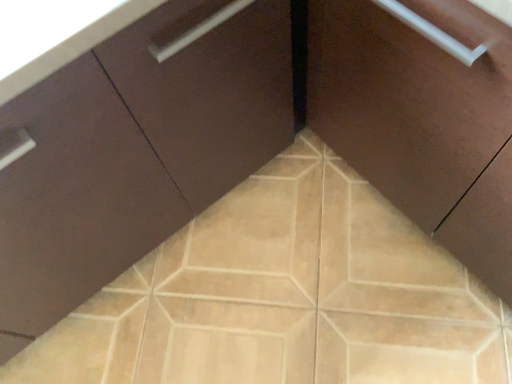
Find the location of a particular element. The image size is (512, 384). matte brown cabinet at center, which appears as the 1th cabinetry when viewed from the left is located at coordinates (134, 150).

Find the location of a particular element. This screenshot has height=384, width=512. matte brown cabinet at center, which is the second cabinetry from left to right is located at coordinates (422, 120).

At what (x,y) coordinates should I click in order to perform the action: click on beige ceramic tile at center. Please return your answer as a coordinate pair (x, y). Looking at the image, I should click on (285, 296).

From the image's perspective, is matte brown cabinet at center, which is the second cabinetry from left to right, below beige ceramic tile at center?

No, from the image's perspective, matte brown cabinet at center, which is the second cabinetry from left to right, is not beneath beige ceramic tile at center.

Considering the positions of objects matte brown cabinet at center, arranged as the 1th cabinetry when viewed from the right, and beige ceramic tile at center in the image provided, who is more to the right, matte brown cabinet at center, arranged as the 1th cabinetry when viewed from the right, or beige ceramic tile at center?

Positioned to the right is matte brown cabinet at center, arranged as the 1th cabinetry when viewed from the right.

Considering the sizes of matte brown cabinet at center, which is the second cabinetry from left to right, and beige ceramic tile at center in the image, is matte brown cabinet at center, which is the second cabinetry from left to right, taller or shorter than beige ceramic tile at center?

Clearly, matte brown cabinet at center, which is the second cabinetry from left to right, is taller compared to beige ceramic tile at center.

Is matte brown cabinet at center, arranged as the 1th cabinetry when viewed from the right, touching beige ceramic tile at center?

No, matte brown cabinet at center, arranged as the 1th cabinetry when viewed from the right, is not making contact with beige ceramic tile at center.

Is matte brown cabinet at center, arranged as the 1th cabinetry when viewed from the right, next to matte brown cabinet at center, the 2th cabinetry viewed from the right?

matte brown cabinet at center, arranged as the 1th cabinetry when viewed from the right, is not next to matte brown cabinet at center, the 2th cabinetry viewed from the right, and they're not touching.

Does matte brown cabinet at center, which is the second cabinetry from left to right, come in front of matte brown cabinet at center, the 2th cabinetry viewed from the right?

No.

From the image's perspective, which is above, matte brown cabinet at center, arranged as the 1th cabinetry when viewed from the right, or matte brown cabinet at center, which appears as the 1th cabinetry when viewed from the left?

matte brown cabinet at center, arranged as the 1th cabinetry when viewed from the right.

Is matte brown cabinet at center, which is the second cabinetry from left to right, at the right side of matte brown cabinet at center, the 2th cabinetry viewed from the right?

Yes.

From the image's perspective, between beige ceramic tile at center and matte brown cabinet at center, which is the second cabinetry from left to right, who is located below?

beige ceramic tile at center, from the image's perspective.

Which object is thinner, beige ceramic tile at center or matte brown cabinet at center, arranged as the 1th cabinetry when viewed from the right?

With smaller width is matte brown cabinet at center, arranged as the 1th cabinetry when viewed from the right.

How different are the orientations of beige ceramic tile at center and matte brown cabinet at center, arranged as the 1th cabinetry when viewed from the right, in degrees?

They differ by 0.269 degrees in their facing directions.

Considering the points (145, 331) and (329, 67), which point is in front, point (145, 331) or point (329, 67)?

The point (329, 67) is closer.

Is point (280, 108) in front of point (359, 13)?

No, (280, 108) is further to viewer.

Considering the sizes of objects matte brown cabinet at center, the 2th cabinetry viewed from the right, and matte brown cabinet at center, arranged as the 1th cabinetry when viewed from the right, in the image provided, who is smaller, matte brown cabinet at center, the 2th cabinetry viewed from the right, or matte brown cabinet at center, arranged as the 1th cabinetry when viewed from the right,?

Smaller between the two is matte brown cabinet at center, arranged as the 1th cabinetry when viewed from the right.

Measure the distance from matte brown cabinet at center, which appears as the 1th cabinetry when viewed from the left, to matte brown cabinet at center, which is the second cabinetry from left to right.

They are 17.14 inches apart.

Between matte brown cabinet at center, which appears as the 1th cabinetry when viewed from the left, and matte brown cabinet at center, which is the second cabinetry from left to right, which one appears on the left side from the viewer's perspective?

From the viewer's perspective, matte brown cabinet at center, which appears as the 1th cabinetry when viewed from the left, appears more on the left side.

Is beige ceramic tile at center taller than matte brown cabinet at center, which appears as the 1th cabinetry when viewed from the left?

Incorrect, the height of beige ceramic tile at center is not larger of that of matte brown cabinet at center, which appears as the 1th cabinetry when viewed from the left.

Can you tell me how much beige ceramic tile at center and matte brown cabinet at center, which appears as the 1th cabinetry when viewed from the left, differ in facing direction?

beige ceramic tile at center and matte brown cabinet at center, which appears as the 1th cabinetry when viewed from the left, are facing 90.3 degrees away from each other.

Considering the sizes of objects beige ceramic tile at center and matte brown cabinet at center, the 2th cabinetry viewed from the right, in the image provided, who is wider, beige ceramic tile at center or matte brown cabinet at center, the 2th cabinetry viewed from the right,?

beige ceramic tile at center.

Does matte brown cabinet at center, which appears as the 1th cabinetry when viewed from the left, have a lesser height compared to beige ceramic tile at center?

No.

Is matte brown cabinet at center, which appears as the 1th cabinetry when viewed from the left, beside beige ceramic tile at center?

No, matte brown cabinet at center, which appears as the 1th cabinetry when viewed from the left, is not in contact with beige ceramic tile at center.

Is matte brown cabinet at center, which appears as the 1th cabinetry when viewed from the left, positioned beyond the bounds of beige ceramic tile at center?

Yes.

There is a beige ceramic tile at center. At what (x,y) coordinates should I click in order to perform the action: click on the 1st cabinetry above it (from a real-world perspective). Please return your answer as a coordinate pair (x, y). Looking at the image, I should click on (422, 120).

The width and height of the screenshot is (512, 384). Find the location of `cabinetry behind the matte brown cabinet at center, the 2th cabinetry viewed from the right`. cabinetry behind the matte brown cabinet at center, the 2th cabinetry viewed from the right is located at coordinates (422, 120).

Based on their spatial positions, is matte brown cabinet at center, which appears as the 1th cabinetry when viewed from the left, or matte brown cabinet at center, arranged as the 1th cabinetry when viewed from the right, closer to beige ceramic tile at center?

Based on the image, matte brown cabinet at center, which appears as the 1th cabinetry when viewed from the left, appears to be nearer to beige ceramic tile at center.

Looking at this image, which object lies further to the anchor point matte brown cabinet at center, which appears as the 1th cabinetry when viewed from the left, matte brown cabinet at center, arranged as the 1th cabinetry when viewed from the right, or beige ceramic tile at center?

matte brown cabinet at center, arranged as the 1th cabinetry when viewed from the right, is further to matte brown cabinet at center, which appears as the 1th cabinetry when viewed from the left.

From the image, which object appears to be nearer to matte brown cabinet at center, the 2th cabinetry viewed from the right, beige ceramic tile at center or matte brown cabinet at center, which is the second cabinetry from left to right?

The object closer to matte brown cabinet at center, the 2th cabinetry viewed from the right, is beige ceramic tile at center.

Based on their spatial positions, is matte brown cabinet at center, arranged as the 1th cabinetry when viewed from the right, or matte brown cabinet at center, the 2th cabinetry viewed from the right, closer to beige ceramic tile at center?

The object closer to beige ceramic tile at center is matte brown cabinet at center, the 2th cabinetry viewed from the right.

Based on their spatial positions, is matte brown cabinet at center, the 2th cabinetry viewed from the right, or beige ceramic tile at center closer to matte brown cabinet at center, which is the second cabinetry from left to right?

The object closer to matte brown cabinet at center, which is the second cabinetry from left to right, is matte brown cabinet at center, the 2th cabinetry viewed from the right.

When comparing their distances from matte brown cabinet at center, arranged as the 1th cabinetry when viewed from the right, does beige ceramic tile at center or matte brown cabinet at center, which appears as the 1th cabinetry when viewed from the left, seem closer?

Among the two, matte brown cabinet at center, which appears as the 1th cabinetry when viewed from the left, is located nearer to matte brown cabinet at center, arranged as the 1th cabinetry when viewed from the right.

Where is `ceramic tile between matte brown cabinet at center, the 2th cabinetry viewed from the right, and matte brown cabinet at center, arranged as the 1th cabinetry when viewed from the right, in the horizontal direction`? This screenshot has width=512, height=384. ceramic tile between matte brown cabinet at center, the 2th cabinetry viewed from the right, and matte brown cabinet at center, arranged as the 1th cabinetry when viewed from the right, in the horizontal direction is located at coordinates (285, 296).